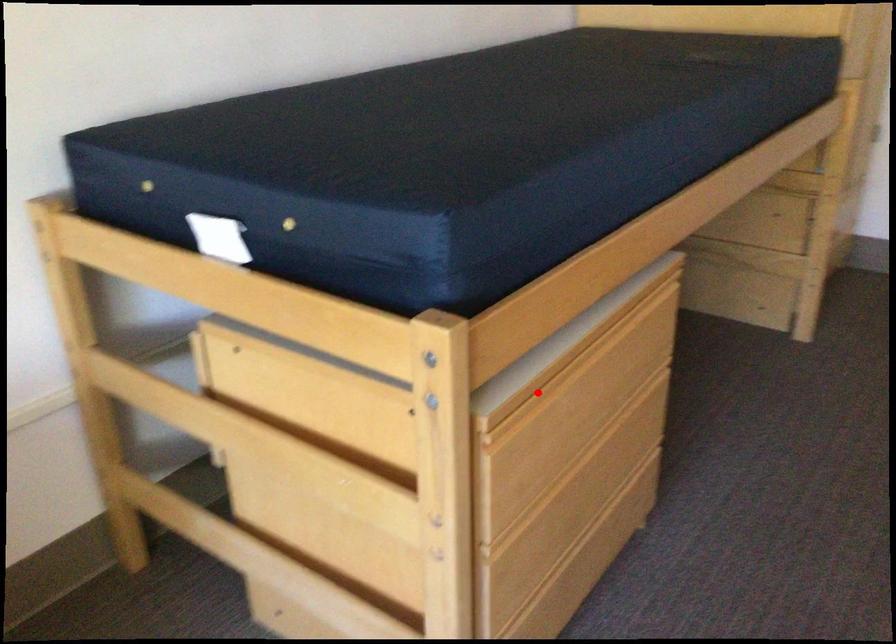
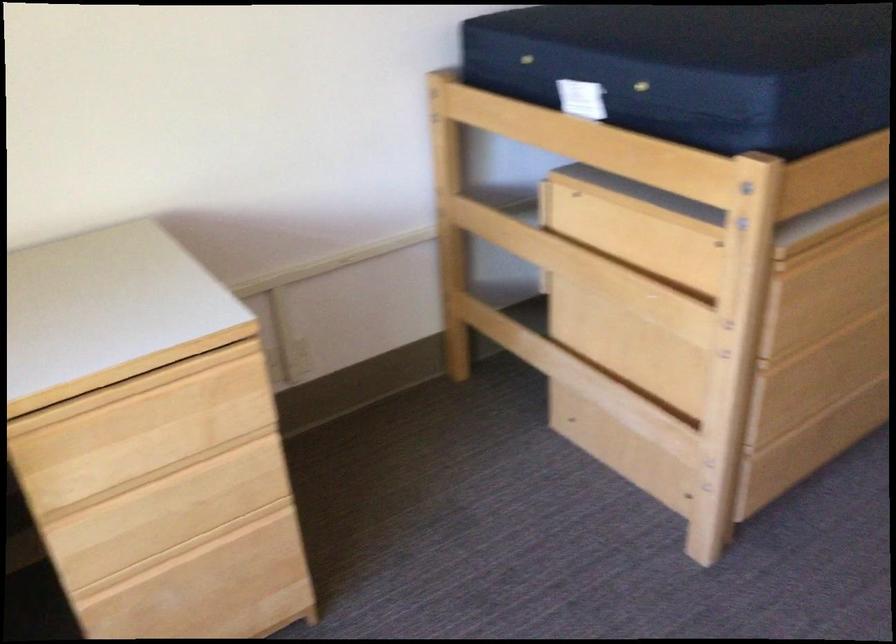
The point at the highlighted location is marked in the first image. Where is the corresponding point in the second image?

(828, 240)